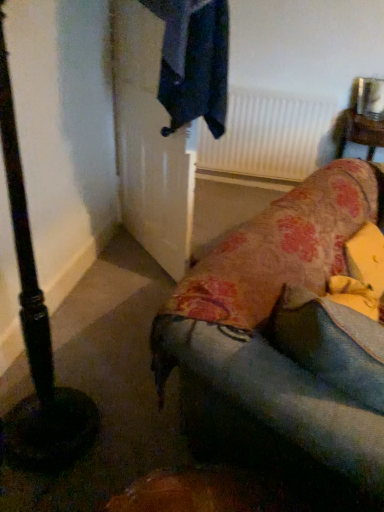
Question: Is floral fabric studio couch at lower right inside the boundaries of black matte pole at left, or outside?

Choices:
 (A) inside
 (B) outside

Answer: (B)

Question: From a real-world perspective, is floral fabric studio couch at lower right positioned above or below black matte pole at left?

Choices:
 (A) below
 (B) above

Answer: (A)

Question: Estimate the real-world distances between objects in this image. Which object is farther from the denim cushion at lower right?

Choices:
 (A) floral fabric studio couch at lower right
 (B) white matte radiator at upper center
 (C) black matte pole at left
 (D) wooden table at upper right

Answer: (B)

Question: Which object is positioned farthest from the black matte pole at left?

Choices:
 (A) white matte radiator at upper center
 (B) floral fabric studio couch at lower right
 (C) wooden table at upper right
 (D) denim cushion at lower right

Answer: (A)